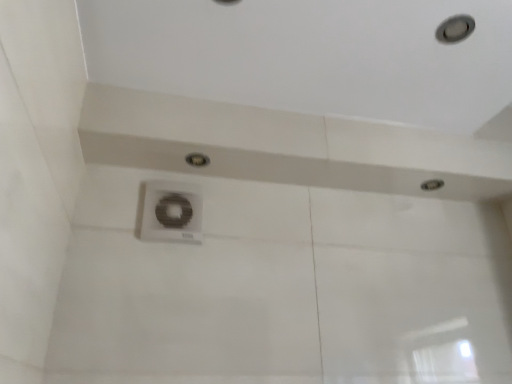
Question: Is matte silver droplight at center, the 2th droplight in the right-to-left sequence, wider than white plastic vent at center?

Choices:
 (A) yes
 (B) no

Answer: (A)

Question: Are matte silver droplight at center, the first droplight when ordered from front to back, and white plastic vent at center far apart?

Choices:
 (A) yes
 (B) no

Answer: (B)

Question: Is matte silver droplight at center, the 1th droplight from the top, touching white plastic vent at center?

Choices:
 (A) yes
 (B) no

Answer: (B)

Question: Can you confirm if matte silver droplight at center, the 1th droplight from the top, is shorter than white plastic vent at center?

Choices:
 (A) yes
 (B) no

Answer: (A)

Question: Can you confirm if matte silver droplight at center, the 2th droplight in the bottom-to-top sequence, is thinner than white plastic vent at center?

Choices:
 (A) yes
 (B) no

Answer: (B)

Question: From a real-world perspective, is matte silver droplight at upper right, the first droplight ordered from the bottom, physically located above or below matte silver droplight at center, the 2th droplight in the bottom-to-top sequence?

Choices:
 (A) below
 (B) above

Answer: (B)

Question: Based on their sizes in the image, would you say matte silver droplight at upper right, the first droplight ordered from the bottom, is bigger or smaller than matte silver droplight at center, the 1th droplight from the top?

Choices:
 (A) small
 (B) big

Answer: (A)

Question: Is matte silver droplight at upper right, which is the 2th droplight from front to back, situated inside matte silver droplight at center, the first droplight when ordered from front to back, or outside?

Choices:
 (A) inside
 (B) outside

Answer: (B)

Question: Would you say matte silver droplight at upper right, which appears as the first droplight when viewed from the right, is to the left or to the right of matte silver droplight at center, the 1th droplight from the top, in the picture?

Choices:
 (A) right
 (B) left

Answer: (A)

Question: In terms of height, does matte silver droplight at upper right, which appears as the first droplight when viewed from the right, look taller or shorter compared to white plastic vent at center?

Choices:
 (A) tall
 (B) short

Answer: (B)

Question: From a real-world perspective, is matte silver droplight at upper right, which appears as the first droplight when viewed from the right, physically located above or below white plastic vent at center?

Choices:
 (A) above
 (B) below

Answer: (A)

Question: Based on their sizes in the image, would you say matte silver droplight at upper right, which appears as the 2th droplight when viewed from the left, is bigger or smaller than white plastic vent at center?

Choices:
 (A) big
 (B) small

Answer: (B)

Question: From the image's perspective, is matte silver droplight at upper right, arranged as the 2th droplight when viewed from the top, positioned above or below white plastic vent at center?

Choices:
 (A) above
 (B) below

Answer: (A)

Question: Does point (167, 221) appear closer or farther from the camera than point (198, 162)?

Choices:
 (A) farther
 (B) closer

Answer: (B)

Question: From their relative heights in the image, would you say white plastic vent at center is taller or shorter than matte silver droplight at center, marked as the 1th droplight in a left-to-right arrangement?

Choices:
 (A) tall
 (B) short

Answer: (A)